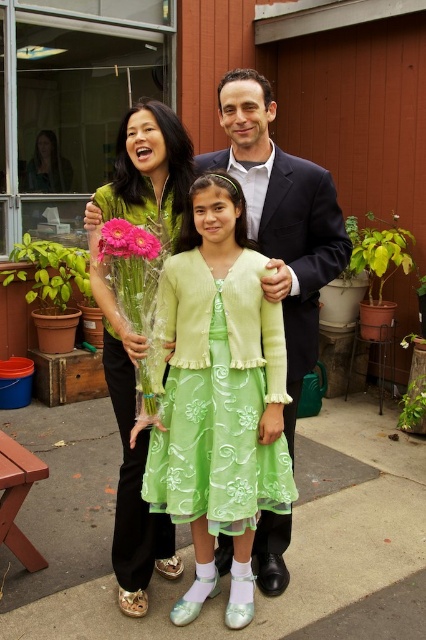
Which is more to the right, lime green satin dress at center or pink matte gerbera at center?

Positioned to the right is lime green satin dress at center.

Is lime green satin dress at center wider than pink matte gerbera at center?

Correct, the width of lime green satin dress at center exceeds that of pink matte gerbera at center.

Is point (158, 330) positioned in front of point (126, 243)?

No, it is behind (126, 243).

Identify the location of lime green satin dress at center. (216, 396).

Is the position of lime green satin dress at center less distant than that of dark blue suit at center?

That is True.

Does lime green satin dress at center have a greater height compared to dark blue suit at center?

No, lime green satin dress at center is not taller than dark blue suit at center.

Who is more forward, (229, 321) or (296, 224)?

Positioned in front is point (229, 321).

The width and height of the screenshot is (426, 640). I want to click on lime green satin dress at center, so click(216, 396).

Can you confirm if matte green dress at left is shorter than pink matte gerbera at center?

In fact, matte green dress at left may be taller than pink matte gerbera at center.

Does matte green dress at left appear on the left side of pink matte gerbera at center?

No, matte green dress at left is not to the left of pink matte gerbera at center.

Locate an element on the screen. The image size is (426, 640). matte green dress at left is located at coordinates (135, 333).